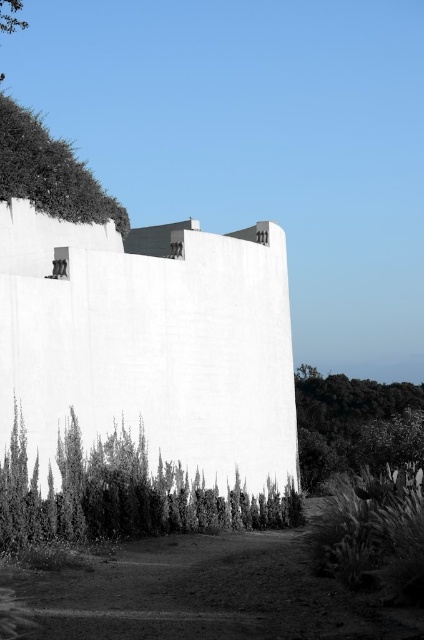
Looking at this image, you are standing in front of the large white building and notice the green leafy shrub at lower left. Based on its position, which direction should you walk to find it?

The green leafy shrub at lower left is located at point (122, 496), which means it is positioned to the lower left of the image. To reach it, you should walk towards the lower left direction from your current position in front of the building.

You are a landscape architect designing a pathway between the green leafy shrub at lower left and the green leafy tree at upper left. Given that the shrub and tree are 65.04 meters apart, what is the minimum length the pathway must be to connect them directly?

The minimum length the pathway must be to connect the green leafy shrub at lower left and the green leafy tree at upper left directly is 65.04 meters, as that is the distance between them.